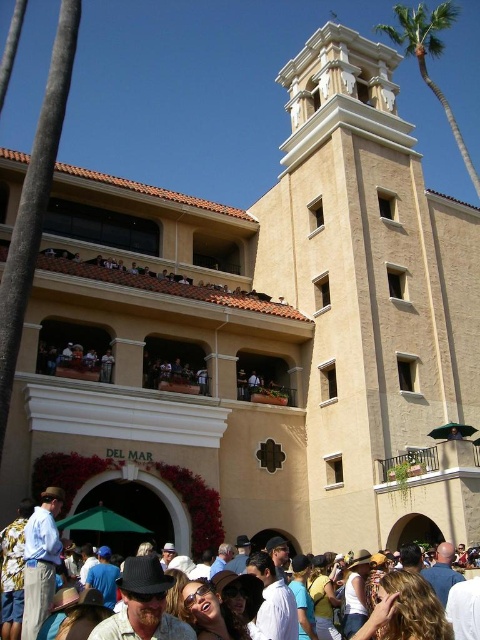
Does beige stucco bell tower at upper center have a smaller size compared to multicolored fabric crowd at lower center?

No, beige stucco bell tower at upper center is not smaller than multicolored fabric crowd at lower center.

Does beige stucco bell tower at upper center have a larger size compared to multicolored fabric crowd at lower center?

Yes.

Describe the element at coordinates (372, 296) in the screenshot. I see `beige stucco bell tower at upper center` at that location.

Image resolution: width=480 pixels, height=640 pixels. What are the coordinates of `beige stucco bell tower at upper center` in the screenshot? It's located at (372, 296).

Does beige stucco bell tower at upper center appear over green leafy palm tree at upper right?

No.

Does beige stucco bell tower at upper center come in front of green leafy palm tree at upper right?

Yes, beige stucco bell tower at upper center is closer to the viewer.

At what (x,y) coordinates should I click in order to perform the action: click on beige stucco bell tower at upper center. Please return your answer as a coordinate pair (x, y). The image size is (480, 640). Looking at the image, I should click on (372, 296).

The width and height of the screenshot is (480, 640). In order to click on beige stucco bell tower at upper center in this screenshot , I will do `click(372, 296)`.

Does multicolored fabric crowd at lower center have a lesser height compared to green leafy palm tree at upper right?

Correct, multicolored fabric crowd at lower center is not as tall as green leafy palm tree at upper right.

Can you confirm if multicolored fabric crowd at lower center is thinner than green leafy palm tree at upper right?

Yes.

Is point (224, 577) less distant than point (448, 20)?

Yes, it is.

Identify the location of multicolored fabric crowd at lower center. Image resolution: width=480 pixels, height=640 pixels. (10, 560).